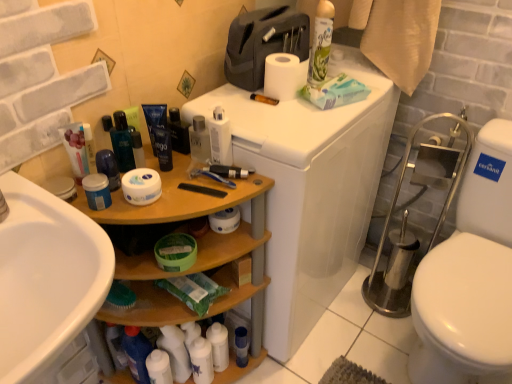
Question: Should I look upward or downward to see white matte toilet paper at upper center?

Choices:
 (A) down
 (B) up

Answer: (B)

Question: Is blue matte jar at left, the eleventh toiletry viewed from the right, placed right next to white plastic toilet at upper right?

Choices:
 (A) yes
 (B) no

Answer: (B)

Question: Considering the relative positions of blue matte jar at left, the eleventh toiletry viewed from the right, and white plastic toilet at upper right in the image provided, is blue matte jar at left, the eleventh toiletry viewed from the right, in front of white plastic toilet at upper right?

Choices:
 (A) yes
 (B) no

Answer: (A)

Question: Is blue matte jar at left, the eleventh toiletry viewed from the right, facing towards white plastic toilet at upper right?

Choices:
 (A) no
 (B) yes

Answer: (A)

Question: From a real-world perspective, is blue matte jar at left, the eleventh toiletry viewed from the right, physically above white plastic toilet at upper right?

Choices:
 (A) yes
 (B) no

Answer: (A)

Question: Is blue matte jar at left, which ranks as the 2th toiletry in left-to-right order, facing away from white plastic toilet at upper right?

Choices:
 (A) no
 (B) yes

Answer: (A)

Question: Is white plastic toilet at upper right a part of blue matte jar at left, which ranks as the 2th toiletry in left-to-right order?

Choices:
 (A) yes
 (B) no

Answer: (B)

Question: Is the position of blue plastic cup at lower center, placed as the first toiletry when sorted from right to left, more distant than that of white glossy lotion at lower center, which ranks as the sixth toiletry in left-to-right order?

Choices:
 (A) yes
 (B) no

Answer: (A)

Question: Can you confirm if blue plastic cup at lower center, placed as the first toiletry when sorted from right to left, is positioned to the right of white glossy lotion at lower center, which ranks as the sixth toiletry in left-to-right order?

Choices:
 (A) no
 (B) yes

Answer: (B)

Question: Can you confirm if blue plastic cup at lower center, placed as the first toiletry when sorted from right to left, is taller than white glossy lotion at lower center, which ranks as the sixth toiletry in left-to-right order?

Choices:
 (A) yes
 (B) no

Answer: (B)

Question: Considering the relative sizes of blue plastic cup at lower center, the 12th toiletry viewed from the left, and white glossy lotion at lower center, which ranks as the sixth toiletry in left-to-right order, in the image provided, is blue plastic cup at lower center, the 12th toiletry viewed from the left, shorter than white glossy lotion at lower center, which ranks as the sixth toiletry in left-to-right order,?

Choices:
 (A) yes
 (B) no

Answer: (A)

Question: Is blue plastic cup at lower center, the 12th toiletry viewed from the left, facing away from white glossy lotion at lower center, which ranks as the sixth toiletry in left-to-right order?

Choices:
 (A) yes
 (B) no

Answer: (B)

Question: Is blue plastic cup at lower center, the 12th toiletry viewed from the left, bigger than white glossy lotion at lower center, which is the 7th toiletry from right to left?

Choices:
 (A) yes
 (B) no

Answer: (B)

Question: Considering the relative sizes of wooden shelf at left and shiny blue bottle at center in the image provided, is wooden shelf at left smaller than shiny blue bottle at center?

Choices:
 (A) yes
 (B) no

Answer: (B)